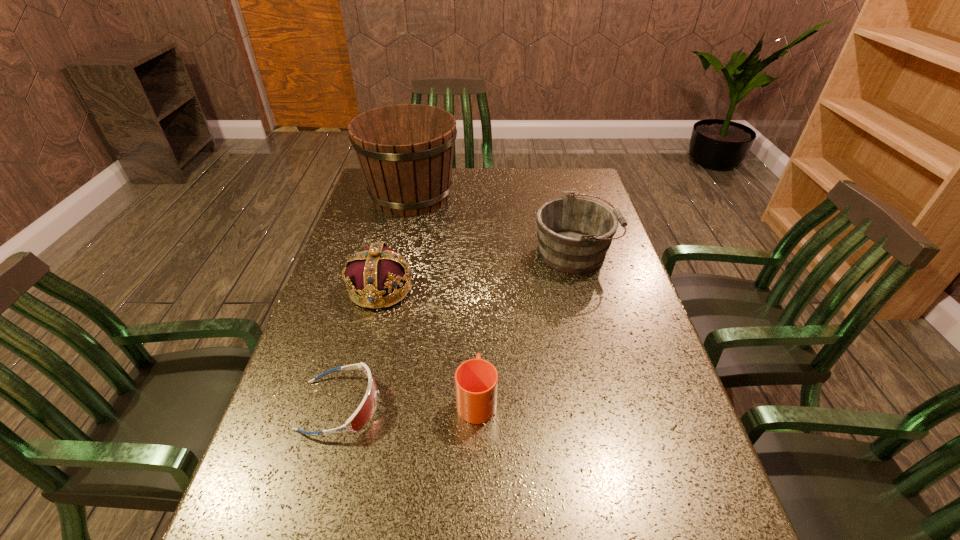
Identify the location of empty space between the mug and the left wine bucket. The width and height of the screenshot is (960, 540). (444, 297).

Locate an element on the screen. The image size is (960, 540). free space between the shorter wine bucket and the goggles is located at coordinates (458, 329).

Identify the location of object that is the closest to the fourth tallest object. (365, 411).

Select which object is the third closest to the shortest object. Please provide its 2D coordinates. Your answer should be formatted as a tuple, i.e. [(x, y)], where the tuple contains the x and y coordinates of a point satisfying the conditions above.

[(574, 234)]

Where is `vacant space that satisfies the following two spatial constraints: 1. on the handle side of the mug; 2. on the right side of the right wine bucket`? vacant space that satisfies the following two spatial constraints: 1. on the handle side of the mug; 2. on the right side of the right wine bucket is located at coordinates (478, 253).

The image size is (960, 540). I want to click on vacant space that satisfies the following two spatial constraints: 1. on the front side of the right wine bucket; 2. on the front-facing side of the goggles, so click(614, 406).